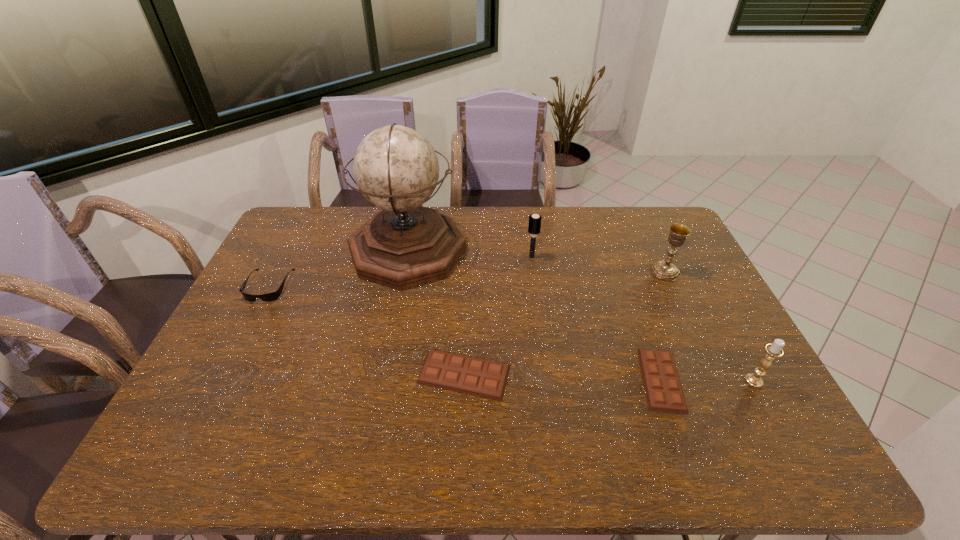
Where is `the left chocolate bar`? the left chocolate bar is located at coordinates (463, 374).

Where is `the taller chocolate bar`? the taller chocolate bar is located at coordinates (463, 374).

This screenshot has height=540, width=960. Find the location of `the shorter chocolate bar`. the shorter chocolate bar is located at coordinates (663, 389).

Image resolution: width=960 pixels, height=540 pixels. I want to click on the fifth object from left to right, so click(663, 389).

You are a GUI agent. You are given a task and a screenshot of the screen. Output one action in this format:
    pyautogui.click(x=<x>, y=<y>)
    Task: Click on the fourth object from right to left
    
    Given the screenshot: What is the action you would take?
    pyautogui.click(x=535, y=220)

Image resolution: width=960 pixels, height=540 pixels. Identify the location of the tallest object. (403, 245).

Find the location of a particular element. the third shortest object is located at coordinates [272, 296].

At what (x,y) coordinates should I click in order to perform the action: click on the leftmost object. Please return your answer as a coordinate pair (x, y). The image size is (960, 540). Looking at the image, I should click on (272, 296).

Identify the location of the sixth object from left to right. The height and width of the screenshot is (540, 960). (666, 270).

At what (x,y) coordinates should I click in order to perform the action: click on candle holder. Please return your answer as a coordinate pair (x, y). The height and width of the screenshot is (540, 960). Looking at the image, I should click on (774, 350).